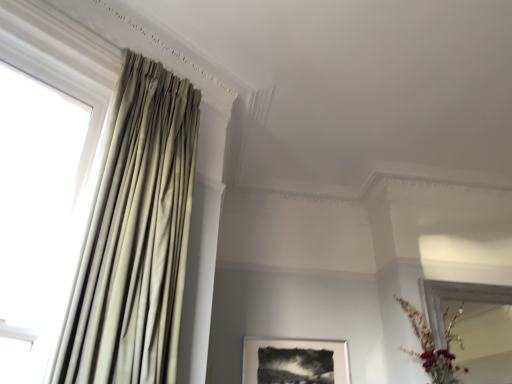
Question: Can you confirm if satin beige curtain at left is positioned to the right of white fabric curtain at left?

Choices:
 (A) yes
 (B) no

Answer: (A)

Question: Is satin beige curtain at left smaller than white fabric curtain at left?

Choices:
 (A) no
 (B) yes

Answer: (A)

Question: Does satin beige curtain at left come in front of white fabric curtain at left?

Choices:
 (A) no
 (B) yes

Answer: (A)

Question: From the image's perspective, is satin beige curtain at left under white fabric curtain at left?

Choices:
 (A) yes
 (B) no

Answer: (A)

Question: Does satin beige curtain at left turn towards white fabric curtain at left?

Choices:
 (A) yes
 (B) no

Answer: (B)

Question: Relative to matte gold vase at lower right, is black matte picture frame at center in front or behind?

Choices:
 (A) behind
 (B) front

Answer: (A)

Question: Is black matte picture frame at center inside or outside of matte gold vase at lower right?

Choices:
 (A) outside
 (B) inside

Answer: (A)

Question: From the image's perspective, is black matte picture frame at center positioned above or below matte gold vase at lower right?

Choices:
 (A) below
 (B) above

Answer: (A)

Question: In the image, is black matte picture frame at center on the left side or the right side of matte gold vase at lower right?

Choices:
 (A) left
 (B) right

Answer: (A)

Question: From a real-world perspective, is black matte picture frame at center physically located above or below white fabric curtain at left?

Choices:
 (A) below
 (B) above

Answer: (A)

Question: Looking at their shapes, would you say black matte picture frame at center is wider or thinner than white fabric curtain at left?

Choices:
 (A) wide
 (B) thin

Answer: (B)

Question: From the image's perspective, is black matte picture frame at center located above or below white fabric curtain at left?

Choices:
 (A) above
 (B) below

Answer: (B)

Question: Is black matte picture frame at center taller or shorter than white fabric curtain at left?

Choices:
 (A) tall
 (B) short

Answer: (B)

Question: Does point (96, 170) appear closer or farther from the camera than point (72, 317)?

Choices:
 (A) farther
 (B) closer

Answer: (A)

Question: Is white fabric curtain at left bigger or smaller than satin beige curtain at left?

Choices:
 (A) small
 (B) big

Answer: (A)